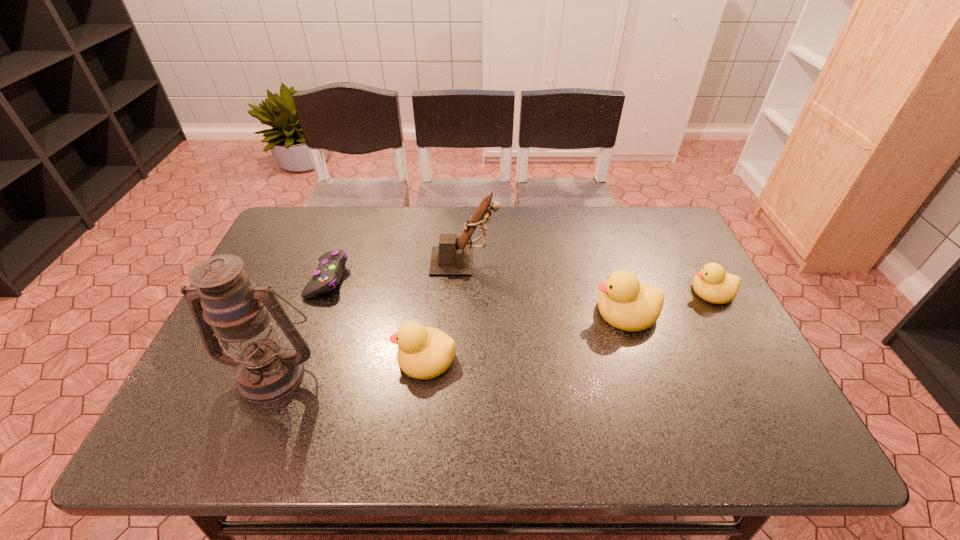
At what (x,y) coordinates should I click in order to perform the action: click on the second shortest duckling. Please return your answer as a coordinate pair (x, y). This screenshot has width=960, height=540. Looking at the image, I should click on (423, 353).

I want to click on the nearest duckling, so click(423, 353).

I want to click on the second duckling from right to left, so click(625, 303).

The width and height of the screenshot is (960, 540). In order to click on the rightmost duckling in this screenshot , I will do `click(712, 284)`.

Find the location of a particular element. The image size is (960, 540). the shortest duckling is located at coordinates (712, 284).

Where is `the shortest object`? the shortest object is located at coordinates (329, 272).

Where is `figurine`? The height and width of the screenshot is (540, 960). figurine is located at coordinates (452, 257).

Locate an element on the screen. The image size is (960, 540). the tallest object is located at coordinates (267, 369).

You are a GUI agent. You are given a task and a screenshot of the screen. Output one action in this format:
    pyautogui.click(x=<x>, y=<y>)
    Task: Click on the vacant area located 0.170m on the face of the second shortest duckling
    The width and height of the screenshot is (960, 540).
    Given the screenshot: What is the action you would take?
    pyautogui.click(x=323, y=358)

The height and width of the screenshot is (540, 960). Find the location of `vacant region located 0.160m on the face of the second shortest duckling`. vacant region located 0.160m on the face of the second shortest duckling is located at coordinates (327, 358).